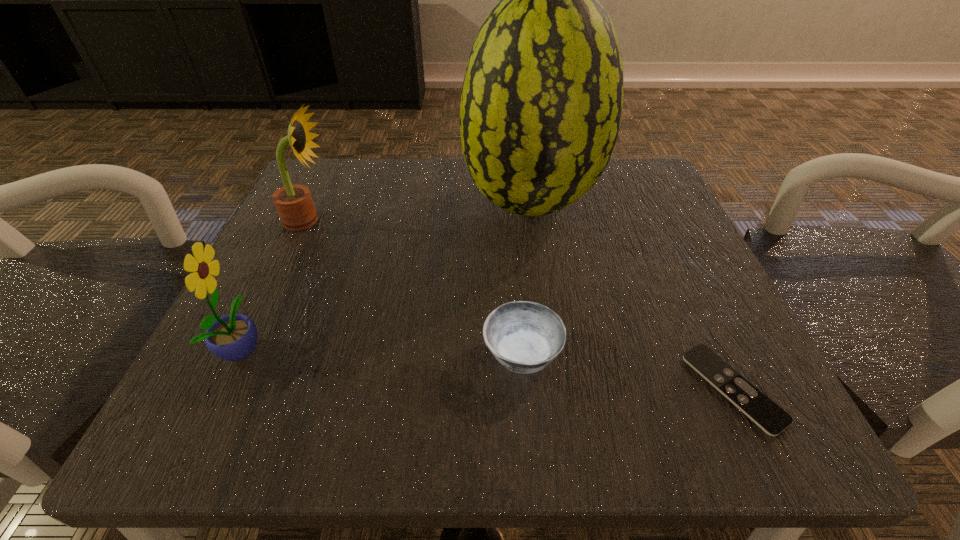
At what (x,y) coordinates should I click in order to perform the action: click on empty space between the watermelon and the second tallest object. Please return your answer as a coordinate pair (x, y). Looking at the image, I should click on (420, 213).

Find the location of a particular element. blank region between the tallest object and the second tallest object is located at coordinates (420, 213).

Locate an element on the screen. The height and width of the screenshot is (540, 960). unoccupied area between the tallest object and the nearer sunflower is located at coordinates (387, 276).

The width and height of the screenshot is (960, 540). Find the location of `unoccupied position between the rightmost object and the second shortest object`. unoccupied position between the rightmost object and the second shortest object is located at coordinates (628, 371).

Find the location of a particular element. Image resolution: width=960 pixels, height=540 pixels. unoccupied area between the ashtray and the farther sunflower is located at coordinates (415, 287).

Locate an element on the screen. This screenshot has height=540, width=960. empty location between the remote control and the tallest object is located at coordinates (632, 296).

Identify the location of empty space between the third tallest object and the watermelon. This screenshot has height=540, width=960. (387, 276).

Identify the location of object that stands as the second closest to the ashtray. (541, 104).

I want to click on object that ranks as the fourth closest to the third shortest object, so click(x=772, y=419).

Locate an element on the screen. The image size is (960, 540). vacant area in the image that satisfies the following two spatial constraints: 1. on the front-facing side of the shortest object; 2. on the left side of the shorter sunflower is located at coordinates (223, 388).